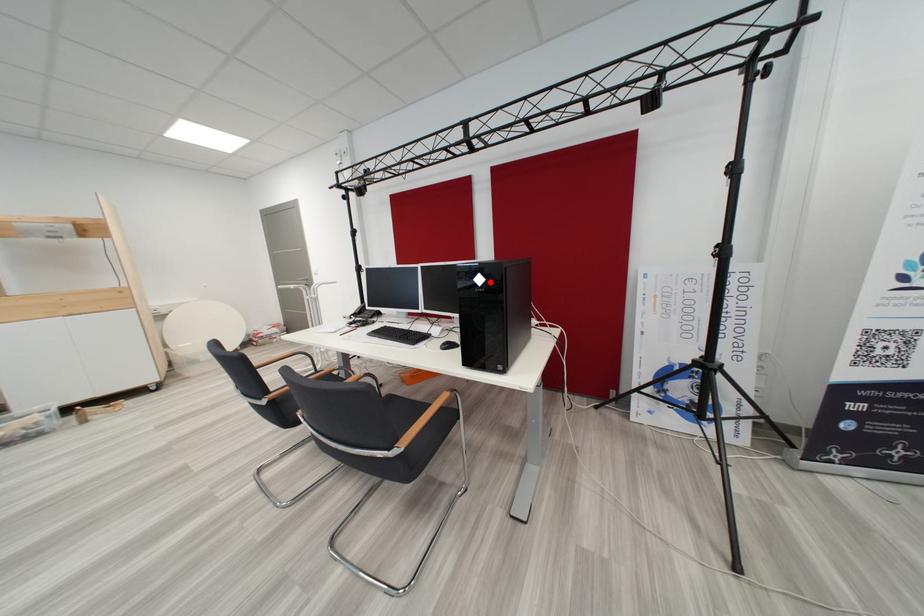
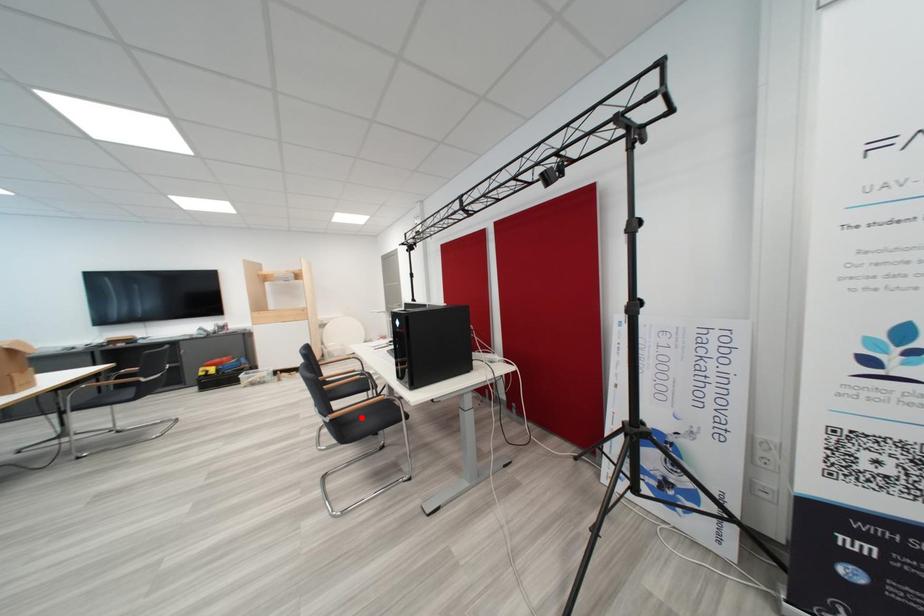
I am providing you with two images of the same scene from different viewpoints. A red point is marked on the first image and another point is marked on the second image. Do the highlighted points in image1 and image2 indicate the same real-world spot?

No